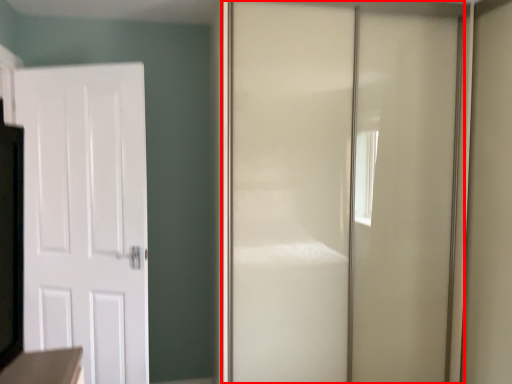
Question: Observing the image, what is the correct spatial positioning of door (annotated by the red box) in reference to door?

Choices:
 (A) left
 (B) right

Answer: (B)